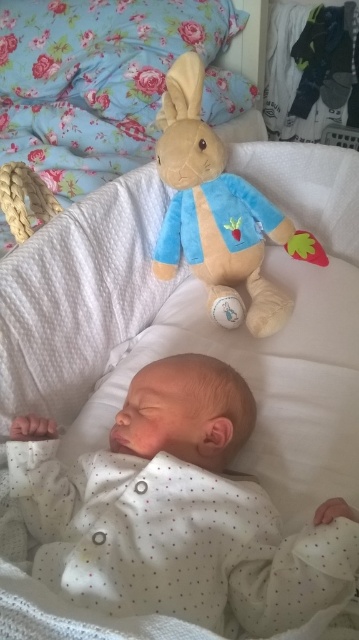
You are a parent checking on your baby. You see the white dotted fabric at center and the soft plush rabbit at upper center. Which object is closer to the baby?

The soft plush rabbit at upper center is closer to the baby since it is positioned above the white dotted fabric at center.

You are a photographer taking a closeup shot of the baby in the bassinet. You need to focus on the white dotted fabric at center. Where should you aim your camera to capture it accurately?

You should aim your camera at point (176, 512) to capture the white dotted fabric at center accurately.

You are a parent holding a baby toy. You want to place it in the bassinet so that it is exactly 18 inches away from the white dotted fabric at center. Is the current position of the soft plush rabbit at upper center too close or too far?

The distance between the white dotted fabric at center and the soft plush rabbit at upper center is 16.94 inches. Since 16.94 is less than 18 inches, the soft plush rabbit at upper center is currently too close to the white dotted fabric at center. To meet the desired distance of 18 inches, the toy needs to be moved slightly further away from the white dotted fabric at center.